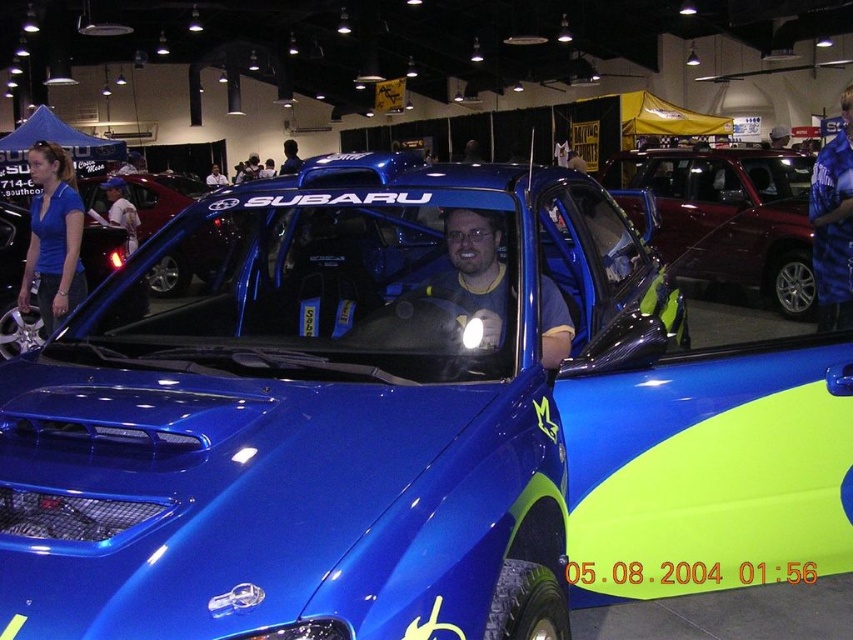
You are a photographer planning to take a photo of both the shiny metallic suv at center and the matte blue car at center. Since you want to capture their full height in the frame, which car should you position closer to the camera to ensure both are fully visible?

The shiny metallic suv at center is taller than the matte blue car at center. To ensure both cars are fully visible in the photo, position the shiny metallic suv at center closer to the camera so that its height fits within the frame while the shorter matte blue car at center can be placed slightly farther back.

Consider the image. You are standing in front of the Subaru vehicle at the auto show and notice two points marked on the car. The first point is at coordinates point (706, 189) and the second is at point (161, 276). Which of these points is nearer to you?

Point (706, 189) is closer to the viewer than point (161, 276).